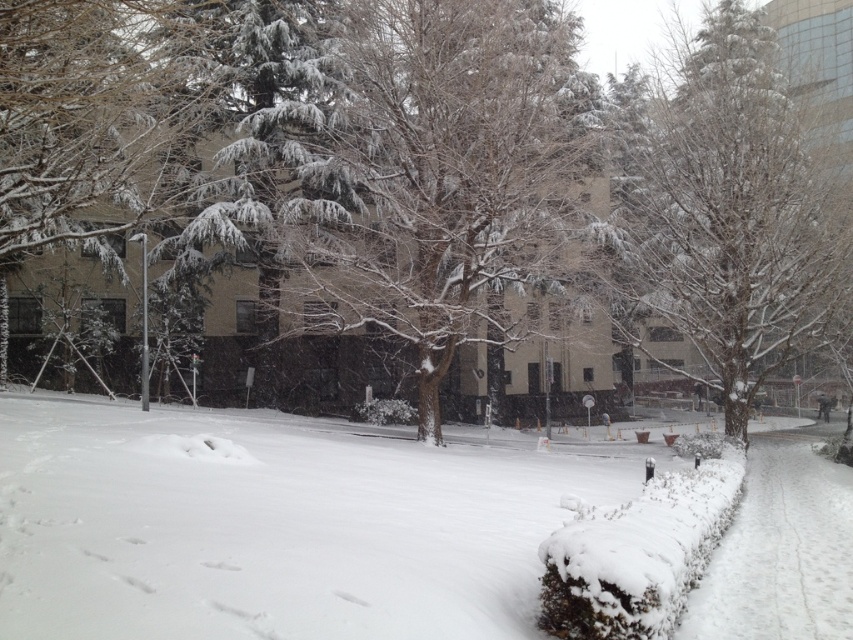
Is white fluffy snow at center above snow-covered tree at center?

No, white fluffy snow at center is not above snow-covered tree at center.

This screenshot has width=853, height=640. What do you see at coordinates (276, 524) in the screenshot? I see `white fluffy snow at center` at bounding box center [276, 524].

The width and height of the screenshot is (853, 640). I want to click on white fluffy snow at center, so click(276, 524).

Is point (486, 83) positioned before point (746, 316)?

Yes, point (486, 83) is closer to viewer.

Is snow-covered tree at center in front of snow-covered tree at right?

Yes, snow-covered tree at center is in front of snow-covered tree at right.

The height and width of the screenshot is (640, 853). I want to click on snow-covered tree at center, so click(x=447, y=173).

Where is `snow-covered tree at center`? This screenshot has height=640, width=853. snow-covered tree at center is located at coordinates (447, 173).

Is white fluffy snow at center shorter than snow-covered tree at right?

Yes.

Does point (228, 504) lie in front of point (740, 186)?

Yes, point (228, 504) is in front of point (740, 186).

Locate an element on the screen. The height and width of the screenshot is (640, 853). white fluffy snow at center is located at coordinates (276, 524).